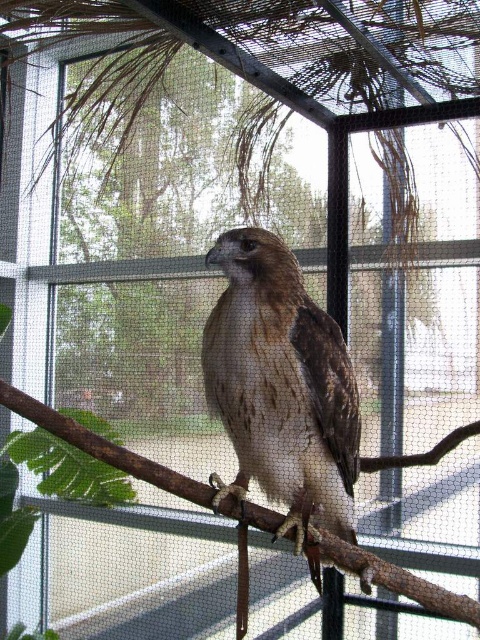
Does brown feathered eagle at center have a larger size compared to brown wood tree branch at center?

Actually, brown feathered eagle at center might be smaller than brown wood tree branch at center.

Consider the image. Is the position of brown feathered eagle at center less distant than that of brown wood tree branch at center?

That is False.

The width and height of the screenshot is (480, 640). What do you see at coordinates (282, 388) in the screenshot?
I see `brown feathered eagle at center` at bounding box center [282, 388].

Where is `brown feathered eagle at center`? This screenshot has height=640, width=480. brown feathered eagle at center is located at coordinates (282, 388).